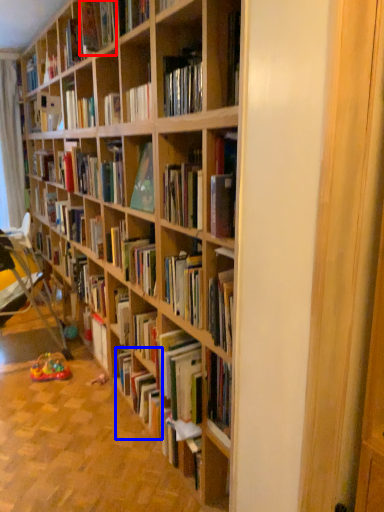
Question: Which of the following is the farthest to the observer, book (highlighted by a red box) or book (highlighted by a blue box)?

Choices:
 (A) book
 (B) book

Answer: (B)